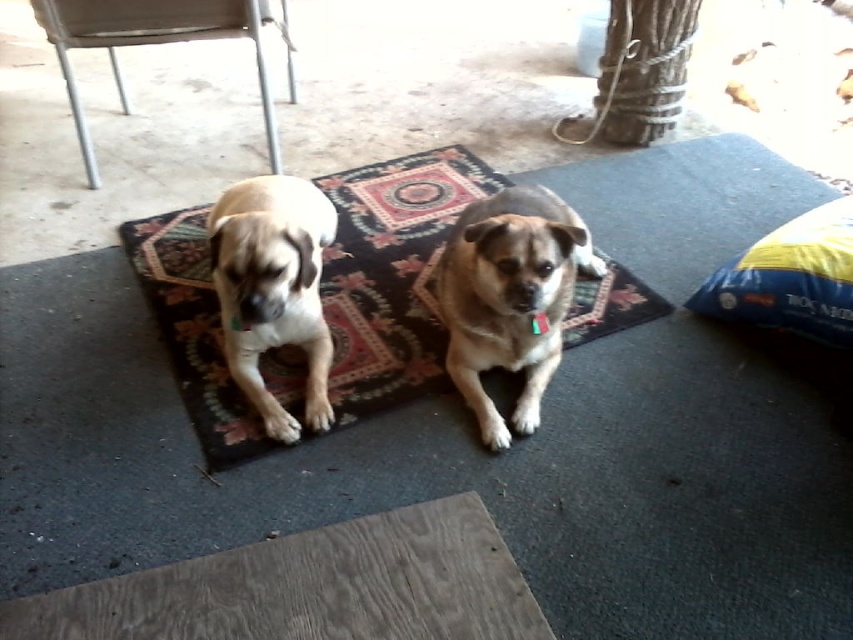
Is yellow fabric pillow at right further to the viewer compared to metallic silver chair at upper left?

No, it is in front of metallic silver chair at upper left.

Between yellow fabric pillow at right and metallic silver chair at upper left, which one is positioned higher?

Positioned higher is metallic silver chair at upper left.

Is point (758, 257) farther from camera compared to point (289, 56)?

No, it is not.

The height and width of the screenshot is (640, 853). In order to click on yellow fabric pillow at right in this screenshot , I will do `click(790, 278)`.

Is fuzzy beige dog at center shorter than metallic silver chair at upper left?

Indeed, fuzzy beige dog at center has a lesser height compared to metallic silver chair at upper left.

At what (x,y) coordinates should I click in order to perform the action: click on fuzzy beige dog at center. Please return your answer as a coordinate pair (x, y). This screenshot has width=853, height=640. Looking at the image, I should click on (273, 289).

Is point (239, 364) closer to camera compared to point (64, 44)?

Yes, it is in front of point (64, 44).

Where is `fuzzy beige dog at center`? fuzzy beige dog at center is located at coordinates (273, 289).

Can you confirm if fuzzy beige dog at center is taller than yellow fabric pillow at right?

Yes, fuzzy beige dog at center is taller than yellow fabric pillow at right.

Is point (265, 284) positioned after point (770, 294)?

No, it is in front of (770, 294).

Identify the location of fuzzy beige dog at center. Image resolution: width=853 pixels, height=640 pixels. (273, 289).